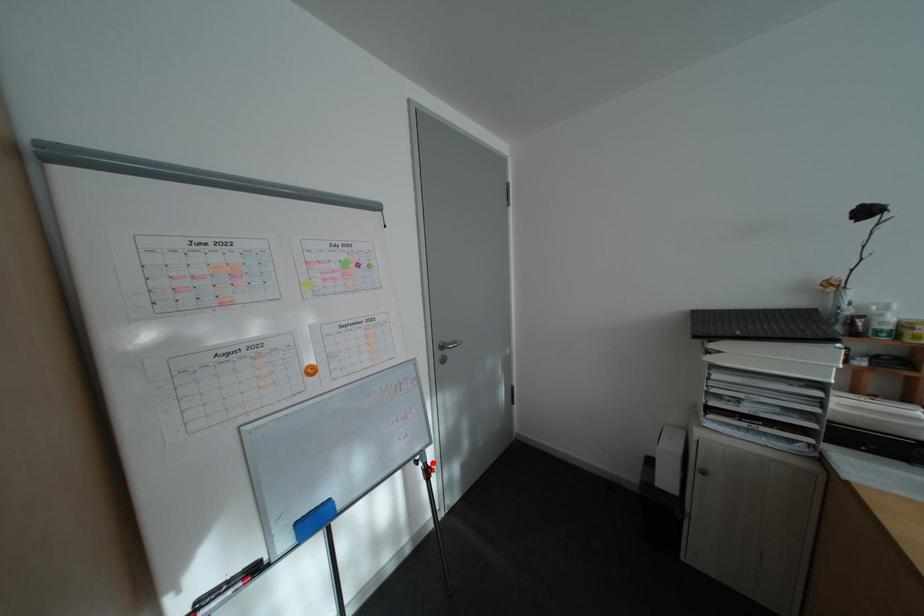
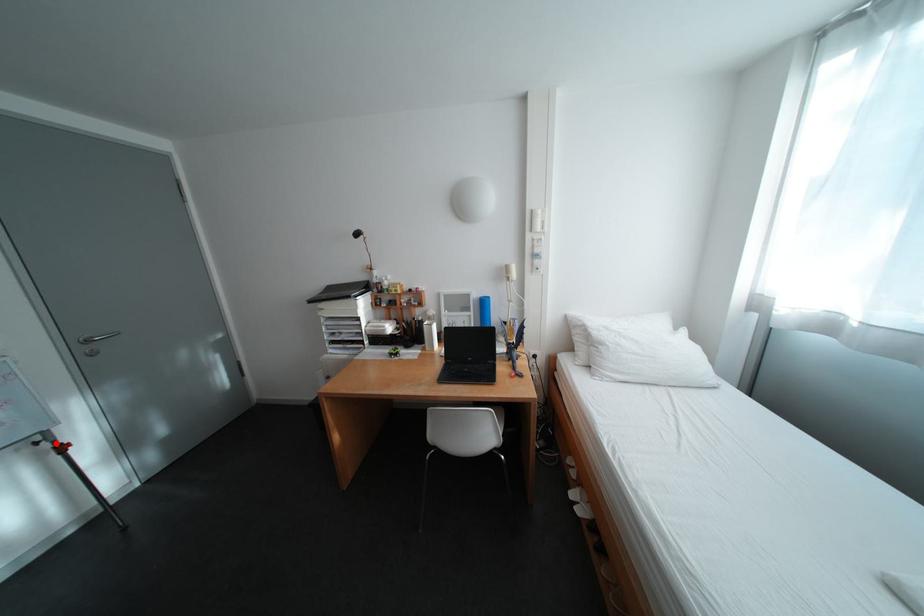
I am providing you with two images of the same scene from different viewpoints. A red point is marked on the first image and another point is marked on the second image. Does the point marked in image1 correspond to the same location as the one in image2?

Yes